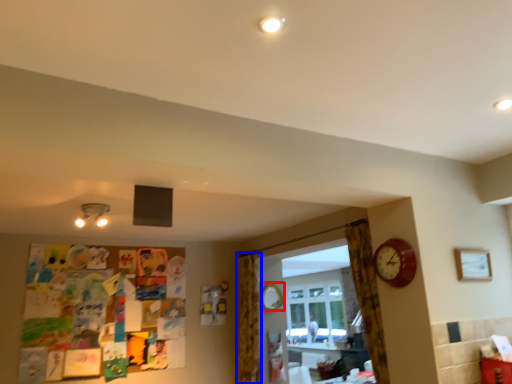
Question: Which of the following is the closest to the observer, mirror (highlighted by a red box) or curtain (highlighted by a blue box)?

Choices:
 (A) mirror
 (B) curtain

Answer: (B)